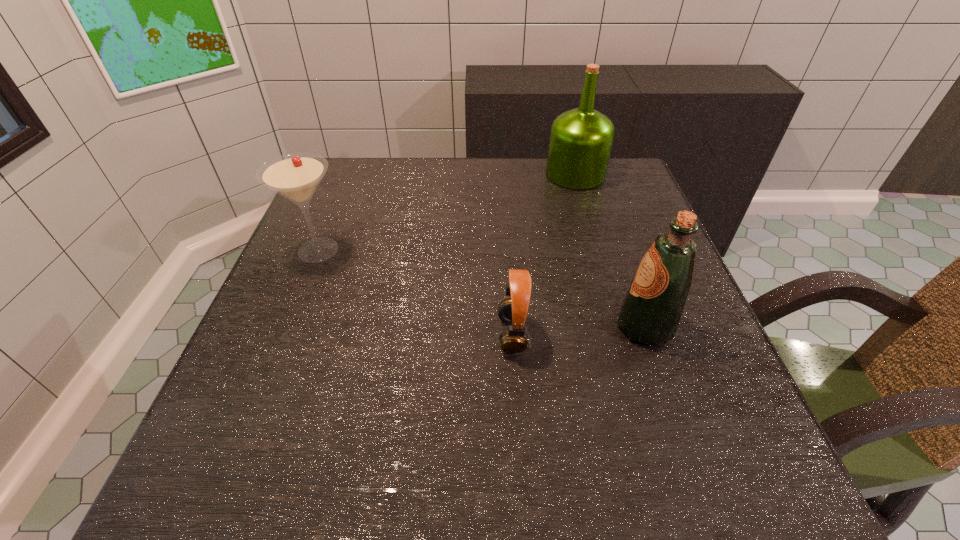
Image resolution: width=960 pixels, height=540 pixels. Find the location of `the farther olive oil`. the farther olive oil is located at coordinates (581, 140).

This screenshot has width=960, height=540. I want to click on the nearer olive oil, so click(650, 313).

Where is `the third tallest object`? the third tallest object is located at coordinates (295, 176).

At what (x,y) coordinates should I click in order to perform the action: click on the third nearest object. Please return your answer as a coordinate pair (x, y). The width and height of the screenshot is (960, 540). Looking at the image, I should click on (295, 176).

Where is `the third object from right to left`? This screenshot has width=960, height=540. the third object from right to left is located at coordinates [512, 310].

The width and height of the screenshot is (960, 540). I want to click on the shortest object, so click(x=512, y=310).

Identify the location of free space located on the left of the farther olive oil. point(494,174).

Identify the location of free space located 0.080m on the front-facing side of the nearer olive oil. pos(573,327).

At what (x,y) coordinates should I click in order to perform the action: click on vacant space located on the front-facing side of the nearer olive oil. Please return your answer as a coordinate pair (x, y). The image size is (960, 540). Looking at the image, I should click on tap(406, 327).

Locate an element on the screen. The image size is (960, 540). free space located on the front-facing side of the nearer olive oil is located at coordinates (524, 327).